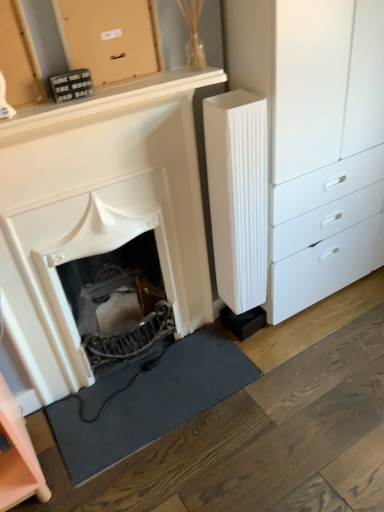
At what (x,y) coordinates should I click in order to perform the action: click on vacant point above black rubber doormat at lower left (from a real-world perspective). Please return your answer as a coordinate pair (x, y). Looking at the image, I should click on (144, 386).